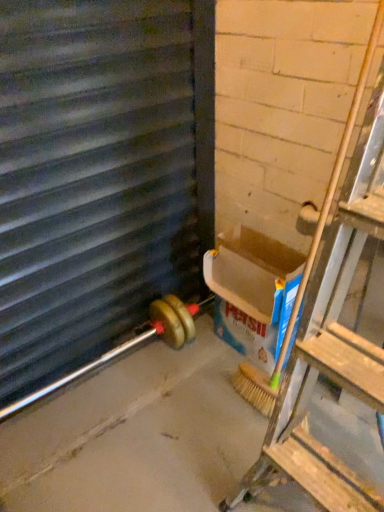
Question: From a real-world perspective, is blue cardboard box at right on metallic gray window frame at left?

Choices:
 (A) yes
 (B) no

Answer: (B)

Question: Would you consider blue cardboard box at right to be distant from metallic gray window frame at left?

Choices:
 (A) no
 (B) yes

Answer: (A)

Question: Can you confirm if blue cardboard box at right is taller than metallic gray window frame at left?

Choices:
 (A) no
 (B) yes

Answer: (A)

Question: From the image's perspective, does blue cardboard box at right appear higher than metallic gray window frame at left?

Choices:
 (A) yes
 (B) no

Answer: (B)

Question: Considering the relative sizes of blue cardboard box at right and metallic gray window frame at left in the image provided, is blue cardboard box at right shorter than metallic gray window frame at left?

Choices:
 (A) no
 (B) yes

Answer: (B)

Question: Can you confirm if blue cardboard box at right is positioned to the left of metallic gray window frame at left?

Choices:
 (A) yes
 (B) no

Answer: (B)

Question: From a real-world perspective, is metallic gray window frame at left physically below blue cardboard box at right?

Choices:
 (A) no
 (B) yes

Answer: (A)

Question: Is metallic gray window frame at left wider than blue cardboard box at right?

Choices:
 (A) yes
 (B) no

Answer: (B)

Question: Is metallic gray window frame at left to the right of blue cardboard box at right from the viewer's perspective?

Choices:
 (A) no
 (B) yes

Answer: (A)

Question: Is metallic gray window frame at left further to camera compared to blue cardboard box at right?

Choices:
 (A) yes
 (B) no

Answer: (B)

Question: Can you confirm if metallic gray window frame at left is positioned to the left of blue cardboard box at right?

Choices:
 (A) yes
 (B) no

Answer: (A)

Question: Could blue cardboard box at right be considered to be inside metallic gray window frame at left?

Choices:
 (A) no
 (B) yes

Answer: (A)

Question: From the image's perspective, is metallic gray window frame at left located above or below blue cardboard box at right?

Choices:
 (A) below
 (B) above

Answer: (B)